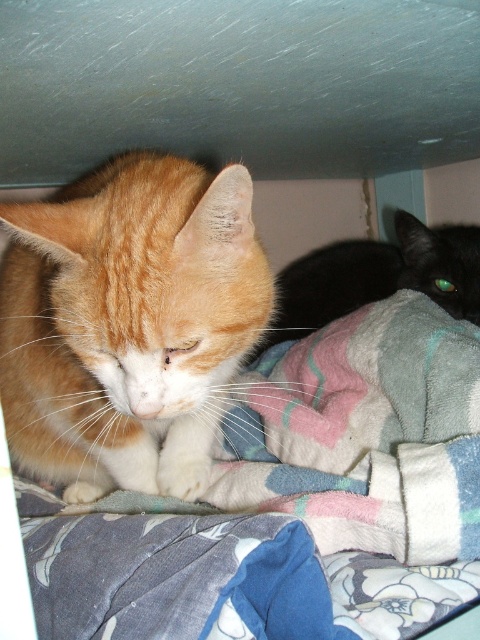
Question: Which point is closer to the camera?

Choices:
 (A) black glossy cat at lower right
 (B) fluffy multicolored blanket at center
 (C) orange fur cat at center

Answer: (B)

Question: Is fluffy multicolored blanket at center above orange fur cat at center?

Choices:
 (A) no
 (B) yes

Answer: (A)

Question: Does fluffy multicolored blanket at center have a lesser width compared to orange fur cat at center?

Choices:
 (A) yes
 (B) no

Answer: (B)

Question: Which point is closer to the camera?

Choices:
 (A) fluffy multicolored blanket at center
 (B) black glossy cat at lower right
 (C) orange fur cat at center

Answer: (A)

Question: From the image, what is the correct spatial relationship of fluffy multicolored blanket at center in relation to black glossy cat at lower right?

Choices:
 (A) right
 (B) left

Answer: (B)

Question: Which object is positioned closest to the orange fur cat at center?

Choices:
 (A) black glossy cat at lower right
 (B) fluffy multicolored blanket at center

Answer: (B)